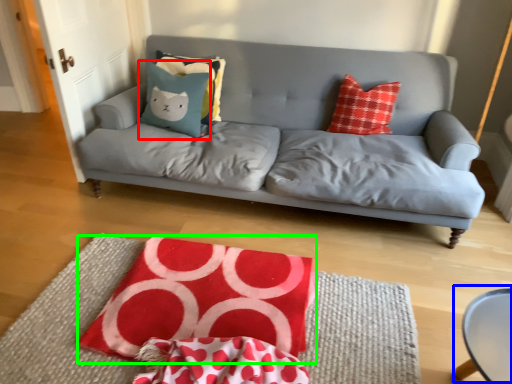
Question: Based on their relative distances, which object is farther from pillow (highlighted by a red box)? Choose from round table (highlighted by a blue box) and quilt (highlighted by a green box).

Choices:
 (A) round table
 (B) quilt

Answer: (A)